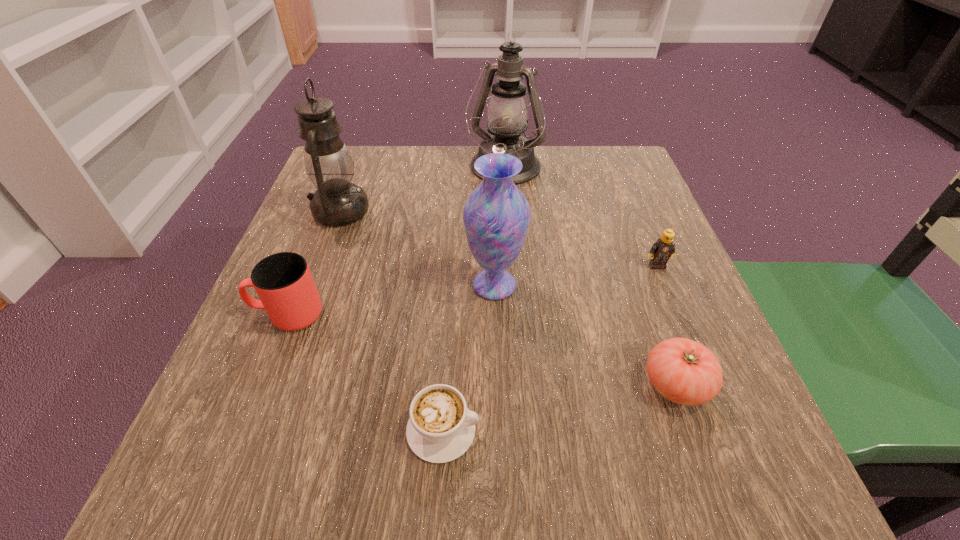
Where is `vacant space at the left edge`? vacant space at the left edge is located at coordinates (309, 404).

Identify the location of vacant space at the right edge of the desktop. click(x=635, y=256).

Find the location of a particular element. free space at the near left corner of the desktop is located at coordinates (234, 472).

Where is `vacant space at the far right corner of the desktop`? vacant space at the far right corner of the desktop is located at coordinates (621, 173).

Find the location of a particular element. This screenshot has height=540, width=960. free spot at the near right corner of the desktop is located at coordinates (660, 489).

The height and width of the screenshot is (540, 960). Find the location of `blank region between the Lego and the vase`. blank region between the Lego and the vase is located at coordinates (576, 275).

Where is `free space between the Lego and the shortest object`? This screenshot has width=960, height=540. free space between the Lego and the shortest object is located at coordinates (550, 348).

You are a GUI agent. You are given a task and a screenshot of the screen. Output one action in this format:
    pyautogui.click(x=<x>, y=<y>)
    Task: Click on the free spot between the fourth tallest object and the Lego
    
    Given the screenshot: What is the action you would take?
    pyautogui.click(x=472, y=290)

I want to click on free space that is in between the tomato and the cappuccino, so click(560, 407).

This screenshot has height=540, width=960. I want to click on free space between the Lego and the vase, so click(x=576, y=275).